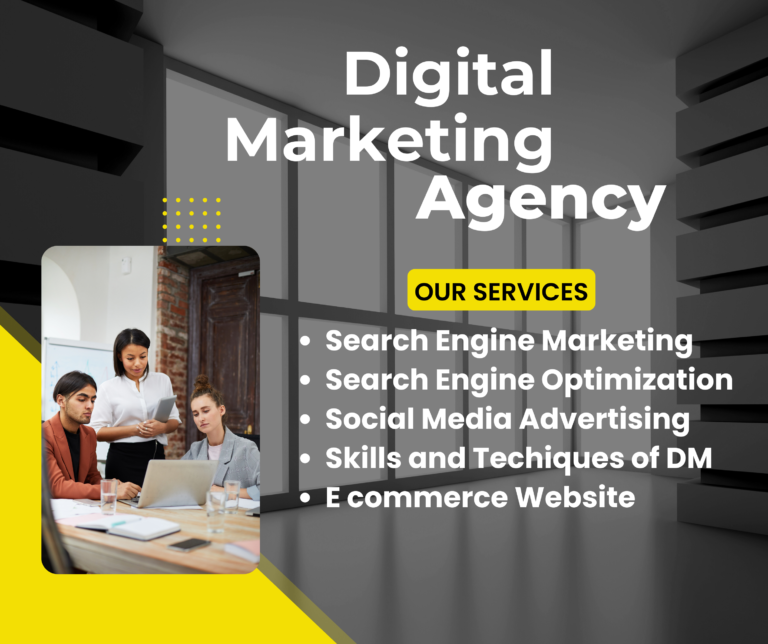
You are a GUI agent. You are given a task and a screenshot of the screen. Output one action in this format:
    pyautogui.click(x=<x>, y=<y>)
    Task: Click on the wall boards
    The height and width of the screenshot is (644, 768).
    Given the screenshot: What is the action you would take?
    pyautogui.click(x=106, y=64), pyautogui.click(x=48, y=209), pyautogui.click(x=730, y=507), pyautogui.click(x=743, y=310), pyautogui.click(x=737, y=252), pyautogui.click(x=722, y=199)